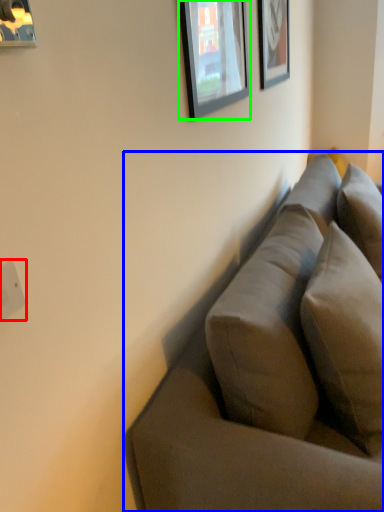
Question: Which object is positioned farthest from electric outlet (highlighted by a red box)? Select from studio couch (highlighted by a blue box) and picture frame (highlighted by a green box).

Choices:
 (A) studio couch
 (B) picture frame

Answer: (B)